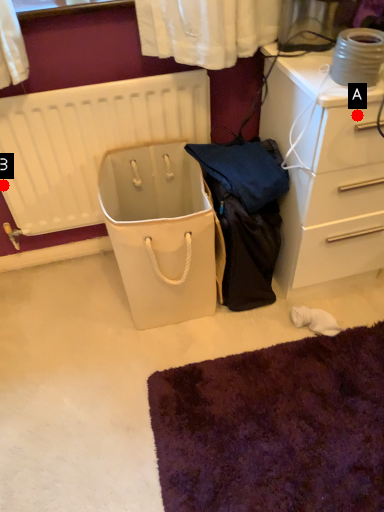
Question: Two points are circled on the image, labeled by A and B beside each circle. Which point is further to the camera?

Choices:
 (A) A is further
 (B) B is further

Answer: (B)